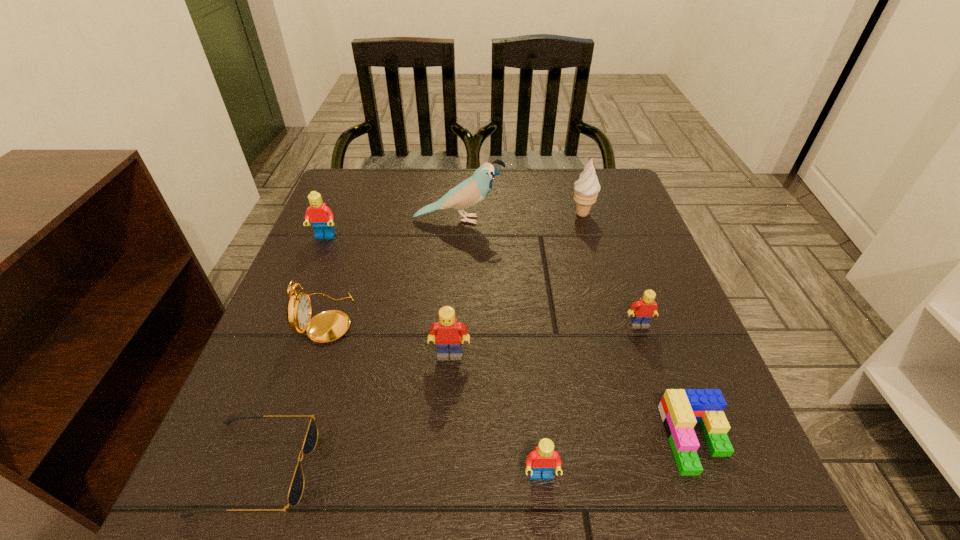
At what (x,y) coordinates should I click in order to perform the action: click on free space between the icecream and the farther yellow Lego. Please return your answer as a coordinate pair (x, y). Image resolution: width=960 pixels, height=540 pixels. Looking at the image, I should click on (611, 269).

Image resolution: width=960 pixels, height=540 pixels. Identify the location of vacant area that lies between the green Lego and the pocket watch. (511, 378).

Where is `free space that is in between the leftmost Lego and the smaller red Lego`? free space that is in between the leftmost Lego and the smaller red Lego is located at coordinates (433, 357).

In order to click on free point between the black sunglasses and the icecream in this screenshot , I will do `click(420, 341)`.

Locate an element on the screen. free space that is in between the bigger yellow Lego and the icecream is located at coordinates [516, 284].

Locate an element on the screen. The height and width of the screenshot is (540, 960). blank region between the smaller red Lego and the black sunglasses is located at coordinates (399, 472).

You are a GUI agent. You are given a task and a screenshot of the screen. Output one action in this format:
    pyautogui.click(x=<x>, y=<y>)
    Task: Click on the free space between the pocket watch and the shortest Lego
    Image resolution: width=960 pixels, height=540 pixels.
    Given the screenshot: What is the action you would take?
    pyautogui.click(x=511, y=378)

Identify which object is located as the third nearest to the blue bird. Please provide its 2D coordinates. Your answer should be formatted as a tuple, i.e. [(x, y)], where the tuple contains the x and y coordinates of a point satisfying the conditions above.

[(327, 326)]

Identify which object is the third closest to the green Lego. Please provide its 2D coordinates. Your answer should be formatted as a tuple, i.e. [(x, y)], where the tuple contains the x and y coordinates of a point satisfying the conditions above.

[(447, 332)]

Where is `Lego that is the closest one to the smaller yellow Lego`? Image resolution: width=960 pixels, height=540 pixels. Lego that is the closest one to the smaller yellow Lego is located at coordinates (680, 409).